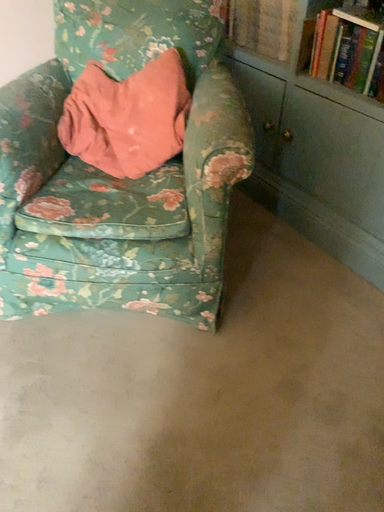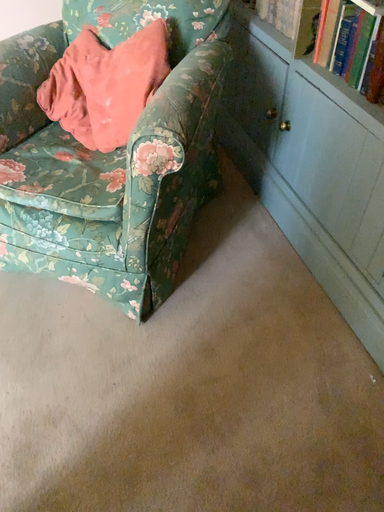
Question: Which way did the camera rotate in the video?

Choices:
 (A) rotated left
 (B) rotated right

Answer: (A)